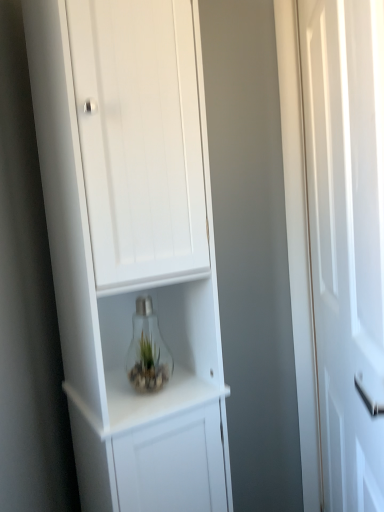
The width and height of the screenshot is (384, 512). Find the location of `white matte cabinet at center`. white matte cabinet at center is located at coordinates (131, 244).

This screenshot has width=384, height=512. What do you see at coordinates (147, 350) in the screenshot?
I see `clear glass bulb at center` at bounding box center [147, 350].

I want to click on white matte cabinet at center, so click(x=131, y=244).

Which is behind, point (57, 4) or point (375, 250)?

The point (57, 4) is more distant.

From the image's perspective, is white matte cabinet at center under white glossy door at right?

No, from the image's perspective, white matte cabinet at center is not below white glossy door at right.

How much distance is there between white matte cabinet at center and white glossy door at right?

The distance of white matte cabinet at center from white glossy door at right is 14.79 inches.

Does white matte cabinet at center have a lesser height compared to white glossy door at right?

Incorrect, the height of white matte cabinet at center does not fall short of that of white glossy door at right.

Is point (354, 369) behind point (136, 227)?

No, it is not.

Who is bigger, white glossy door at right or white matte cabinet at center?

white matte cabinet at center is bigger.

Choose the correct answer: Is white glossy door at right inside white matte cabinet at center or outside it?

white glossy door at right is not inside white matte cabinet at center, it's outside.

Does clear glass bulb at center have a lesser width compared to white glossy door at right?

Yes, clear glass bulb at center is thinner than white glossy door at right.

Is clear glass bulb at center not within white glossy door at right?

Yes.

Is clear glass bulb at center positioned far away from white glossy door at right?

No, there isn't a large distance between clear glass bulb at center and white glossy door at right.

From a real-world perspective, which is physically below, white glossy door at right or clear glass bulb at center?

From a 3D spatial view, clear glass bulb at center is below.

Between white glossy door at right and clear glass bulb at center, which one appears on the right side from the viewer's perspective?

white glossy door at right is more to the right.

Locate an element on the screen. The width and height of the screenshot is (384, 512). glass vase on the left of the white glossy door at right is located at coordinates (147, 350).

How different are the orientations of white glossy door at right and clear glass bulb at center in degrees?

The angular difference between white glossy door at right and clear glass bulb at center is 53 degrees.

Which object is closer to the camera, white matte cabinet at center or clear glass bulb at center?

white matte cabinet at center is more forward.

Can you confirm if white matte cabinet at center is bigger than clear glass bulb at center?

Yes.

Considering the relative positions of white matte cabinet at center and clear glass bulb at center in the image provided, is white matte cabinet at center to the right of clear glass bulb at center from the viewer's perspective?

No, white matte cabinet at center is not to the right of clear glass bulb at center.

What's the angular difference between white matte cabinet at center and clear glass bulb at center's facing directions?

white matte cabinet at center and clear glass bulb at center are facing 0.692 degrees away from each other.

Does clear glass bulb at center touch white matte cabinet at center?

clear glass bulb at center and white matte cabinet at center are not in contact.

From the image's perspective, who appears lower, clear glass bulb at center or white matte cabinet at center?

clear glass bulb at center, from the image's perspective.

From a real-world perspective, is clear glass bulb at center positioned under white matte cabinet at center based on gravity?

Yes, from a real-world perspective, clear glass bulb at center is beneath white matte cabinet at center.

Considering the sizes of objects clear glass bulb at center and white matte cabinet at center in the image provided, who is taller, clear glass bulb at center or white matte cabinet at center?

white matte cabinet at center.

Find the location of a particular element. This screenshot has height=512, width=384. cupboard above the white glossy door at right (from the image's perspective) is located at coordinates (131, 244).

At what (x,y) coordinates should I click in order to perform the action: click on door in front of the white matte cabinet at center. Please return your answer as a coordinate pair (x, y). This screenshot has height=512, width=384. Looking at the image, I should click on (347, 240).

Based on their spatial positions, is white matte cabinet at center or white glossy door at right further from clear glass bulb at center?

The object further to clear glass bulb at center is white glossy door at right.

Based on their spatial positions, is white glossy door at right or white matte cabinet at center closer to clear glass bulb at center?

The object closer to clear glass bulb at center is white matte cabinet at center.

When comparing their distances from white matte cabinet at center, does white glossy door at right or clear glass bulb at center seem closer?

clear glass bulb at center is closer to white matte cabinet at center.

Considering their positions, is white matte cabinet at center positioned further to white glossy door at right than clear glass bulb at center?

Among the two, clear glass bulb at center is located further to white glossy door at right.

Which object lies further to the anchor point white glossy door at right, clear glass bulb at center or white matte cabinet at center?

clear glass bulb at center is positioned further to the anchor white glossy door at right.

Estimate the real-world distances between objects in this image. Which object is closer to white matte cabinet at center, clear glass bulb at center or white glossy door at right?

clear glass bulb at center.

The width and height of the screenshot is (384, 512). In order to click on cupboard between white glossy door at right and clear glass bulb at center from front to back in this screenshot , I will do `click(131, 244)`.